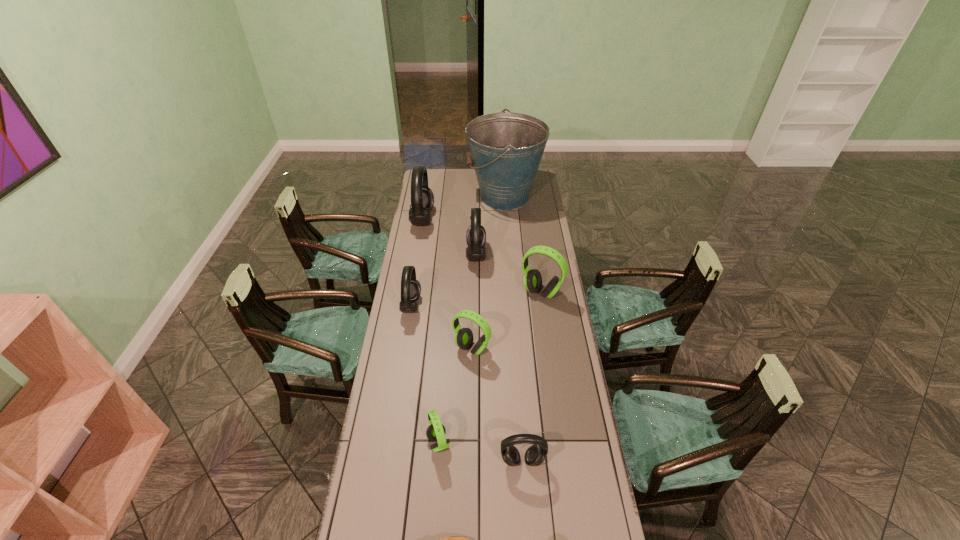
This screenshot has width=960, height=540. What are the coordinates of `empty location between the rightmost gray headset and the sixth farthest object` in the screenshot? It's located at (497, 404).

I want to click on free space between the bucket and the biggest green headset, so click(523, 245).

At what (x,y) coordinates should I click in order to perform the action: click on unoccupied area between the farthest green headset and the third nearest headset. Please return your answer as a coordinate pair (x, y). Looking at the image, I should click on (507, 320).

Locate an element on the screen. The image size is (960, 540). vacant region between the farthest gray headset and the second smallest green headset is located at coordinates pyautogui.click(x=447, y=284).

Where is `vacant area that lies between the rightmost gray headset and the sixth farthest object`? The width and height of the screenshot is (960, 540). vacant area that lies between the rightmost gray headset and the sixth farthest object is located at coordinates click(497, 404).

Where is `the third closest object relative to the biggest green headset`? the third closest object relative to the biggest green headset is located at coordinates (410, 287).

Where is `object that stands as the fourth closest to the second nearest gray headset`? object that stands as the fourth closest to the second nearest gray headset is located at coordinates (532, 280).

Where is `headset that is the closest to the biggest green headset`? This screenshot has width=960, height=540. headset that is the closest to the biggest green headset is located at coordinates (476, 235).

Locate which headset ranks sixth in proximity to the bucket. Please provide its 2D coordinates. Your answer should be formatted as a tuple, i.e. [(x, y)], where the tuple contains the x and y coordinates of a point satisfying the conditions above.

[(436, 431)]

Identify the location of gray headset that is the third closest to the bucket. (410, 287).